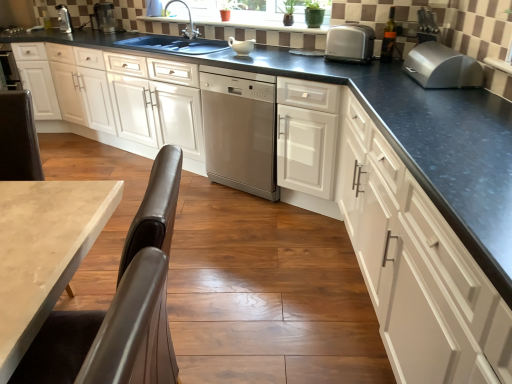
At what (x,y) coordinates should I click in order to perform the action: click on vacant space situated above silver metallic breadbox at upper right, which ranks as the first kitchen appliance in right-to-left order (from a real-world perspective). Please return your answer as a coordinate pair (x, y). Image resolution: width=512 pixels, height=384 pixels. Looking at the image, I should click on (435, 52).